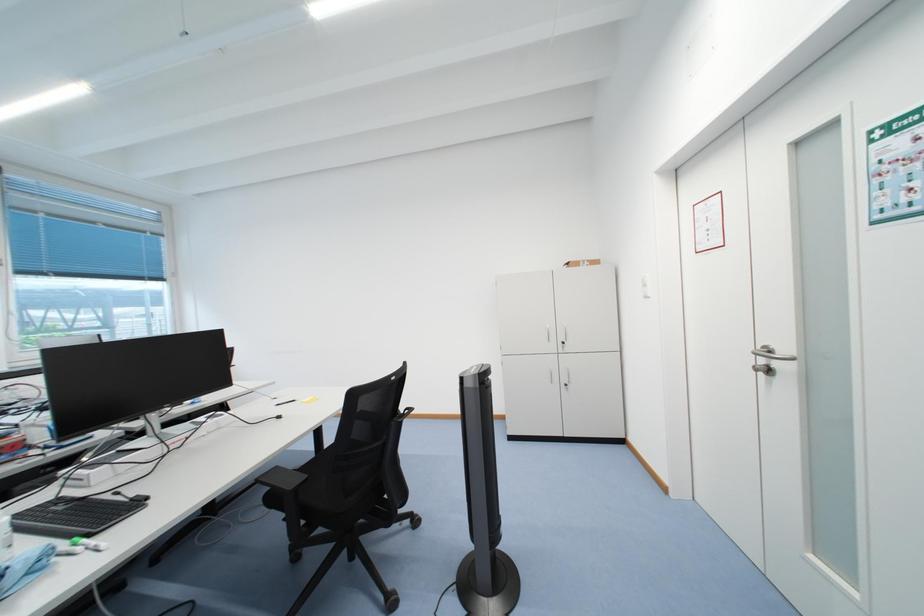
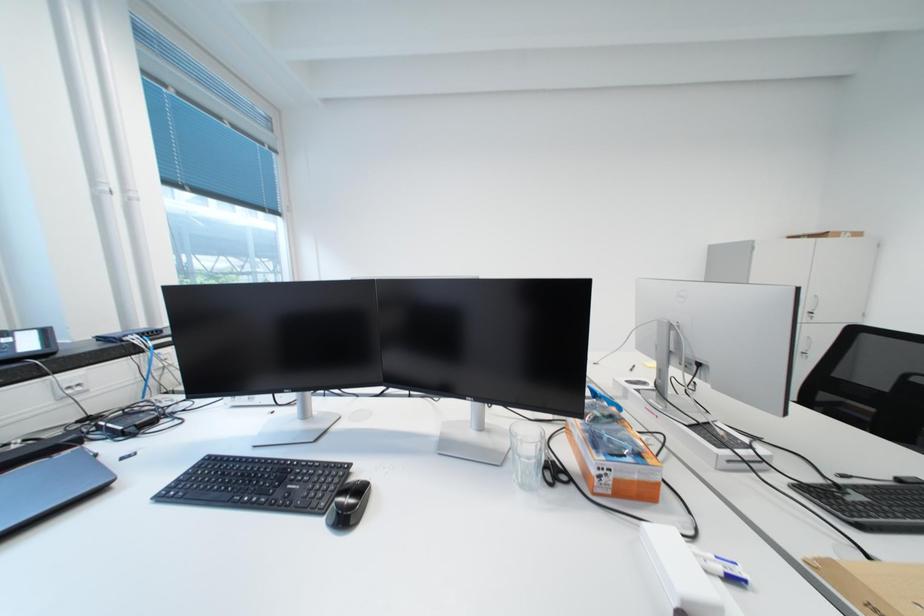
Question: In a continuous first-person perspective shot, in which direction is the camera moving?

Choices:
 (A) Left
 (B) Right
 (C) Forward
 (D) Backward

Answer: (A)